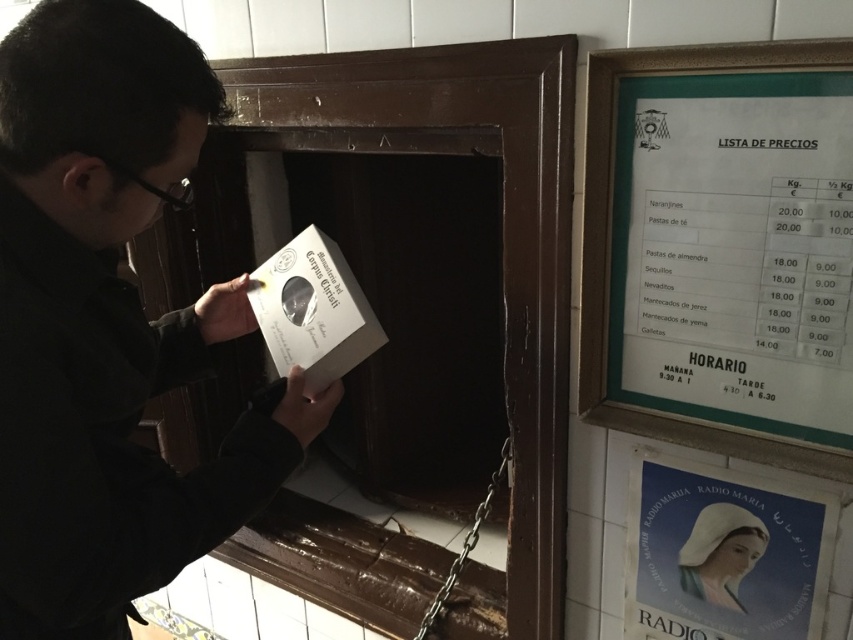
Question: Can you confirm if wooden frame at upper right is thinner than blue paper poster at lower right?

Choices:
 (A) yes
 (B) no

Answer: (B)

Question: Which object is closer to the camera taking this photo?

Choices:
 (A) blue paper poster at lower right
 (B) green cardboard sign at upper right

Answer: (B)

Question: Considering the real-world distances, which object is farthest from the smooth white portrait at center?

Choices:
 (A) wooden frame at upper right
 (B) black matte jacket at center

Answer: (B)

Question: Which object is positioned closest to the blue paper poster at lower right?

Choices:
 (A) green cardboard sign at upper right
 (B) smooth white portrait at center
 (C) wooden frame at upper right

Answer: (B)

Question: Does wooden frame at upper right appear on the right side of smooth white portrait at center?

Choices:
 (A) yes
 (B) no

Answer: (B)

Question: Considering the relative positions of wooden frame at upper right and blue paper poster at lower right in the image provided, where is wooden frame at upper right located with respect to blue paper poster at lower right?

Choices:
 (A) above
 (B) below

Answer: (A)